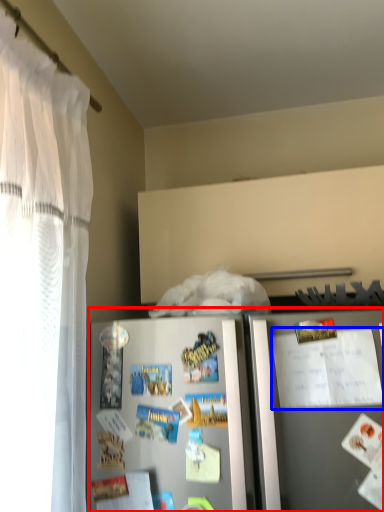
Question: Which point is further to the camera, refrigerator (highlighted by a red box) or comic book (highlighted by a blue box)?

Choices:
 (A) refrigerator
 (B) comic book

Answer: (B)